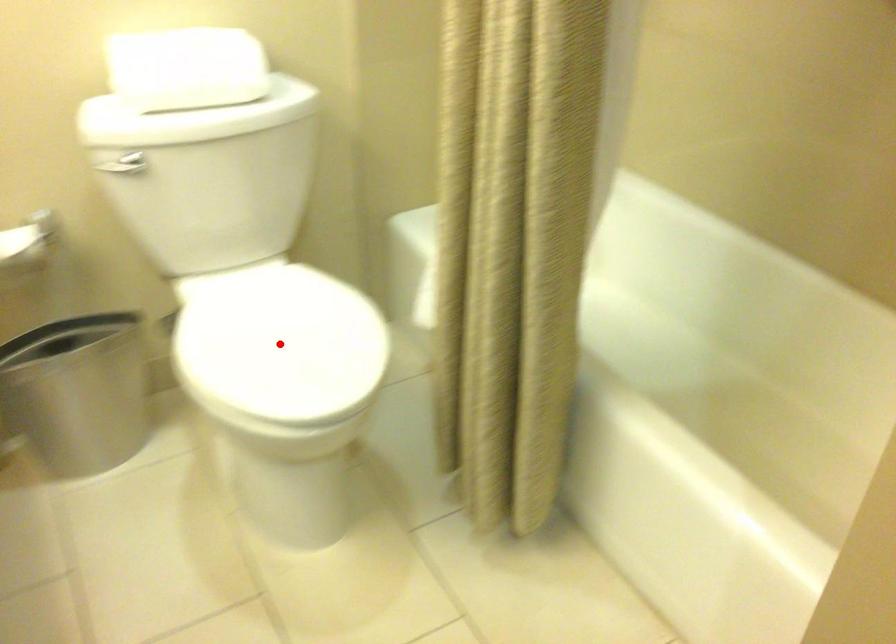
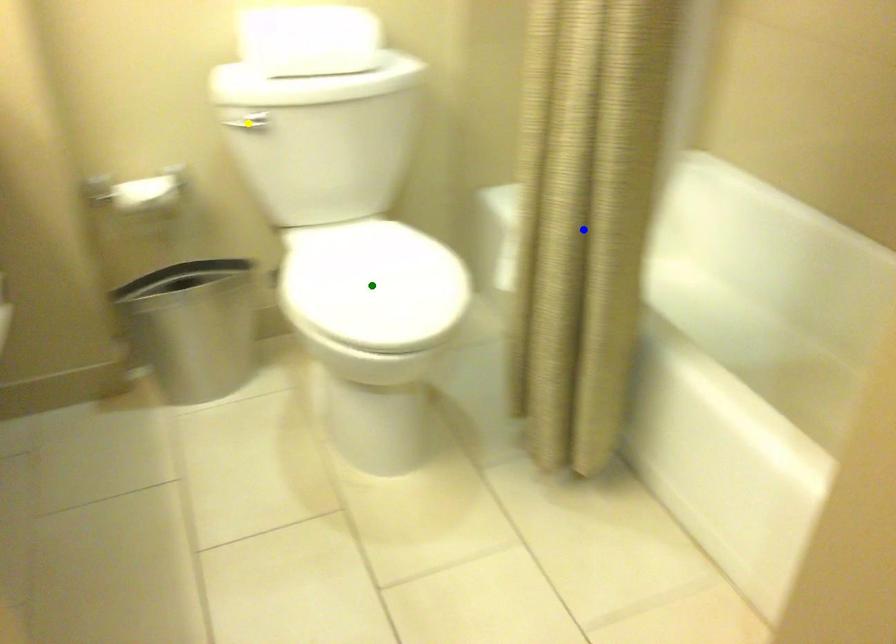
Question: I am providing you with two images of the same scene from different viewpoints. A red point is marked on the first image. You are given multiple points on the second image. In image 2, which mark is for the same physical point as the one in image 1?

Choices:
 (A) green point
 (B) blue point
 (C) yellow point

Answer: (A)